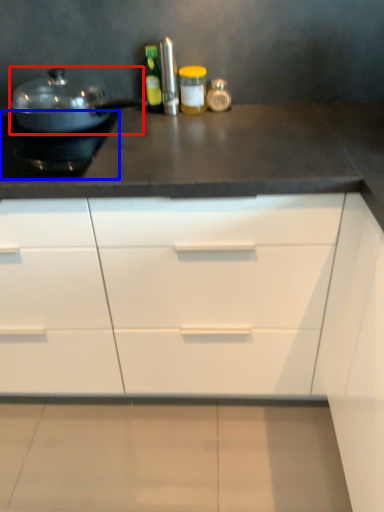
Question: Which point is closer to the camera, kitchen appliance (highlighted by a red box) or appliance (highlighted by a blue box)?

Choices:
 (A) kitchen appliance
 (B) appliance

Answer: (B)